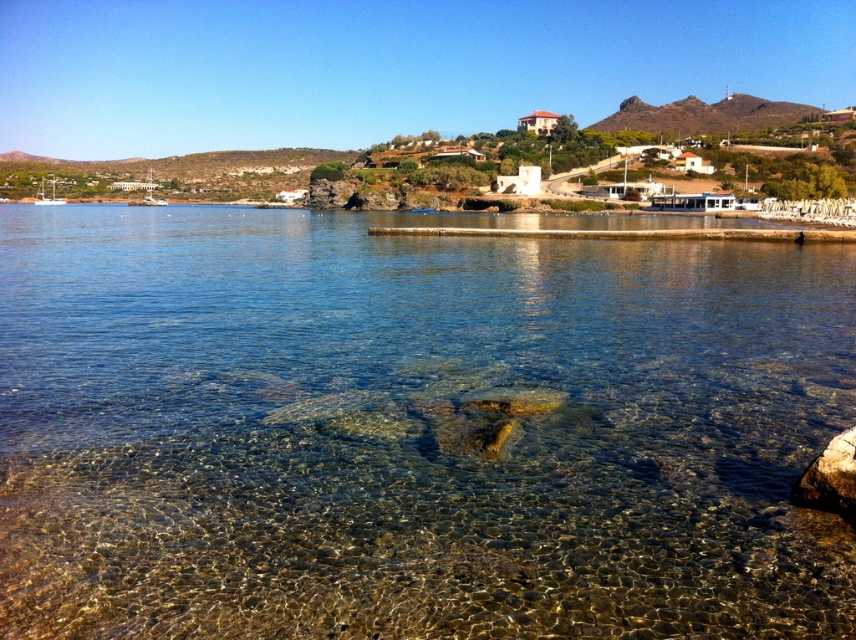
You are standing at the edge of the wooden pier and want to walk towards the point labeled as point [663,129]. However, there is an obstacle at point [822,481]. Based on the coordinates provided, will you encounter the obstacle before reaching your destination?

Since point [663,129] is behind point [822,481], you will encounter the obstacle at point [822,481] before reaching your destination.

You are planning to build a small boat dock. You have two options for placement based on the scene. The first option is near the clear water at center, and the second is near the brown rocky hill at upper right. Considering the available space, which location would provide more room for the dock?

The brown rocky hill at upper right has a wider area compared to the clear water at center, so placing the dock near the brown rocky hill at upper right would provide more room for the dock.